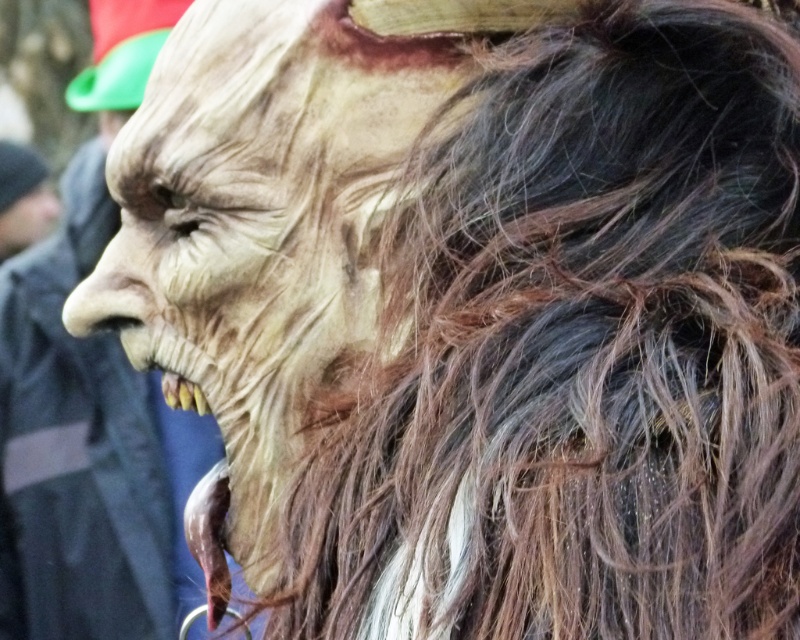
Question: Which object is positioned closest to the matte black face at left?

Choices:
 (A) matte plastic mask at center
 (B) matte plastic mask at left

Answer: (B)

Question: Estimate the real-world distances between objects in this image. Which object is farther from the matte black face at left?

Choices:
 (A) matte plastic mask at left
 (B) matte plastic mask at center

Answer: (B)

Question: Is matte plastic mask at center to the right of matte black face at left from the viewer's perspective?

Choices:
 (A) yes
 (B) no

Answer: (A)

Question: Is matte plastic mask at left positioned before matte black face at left?

Choices:
 (A) yes
 (B) no

Answer: (A)

Question: Considering the relative positions of matte plastic mask at center and matte black face at left in the image provided, where is matte plastic mask at center located with respect to matte black face at left?

Choices:
 (A) above
 (B) below

Answer: (B)

Question: Which object appears closest to the camera in this image?

Choices:
 (A) matte plastic mask at left
 (B) matte black face at left

Answer: (A)